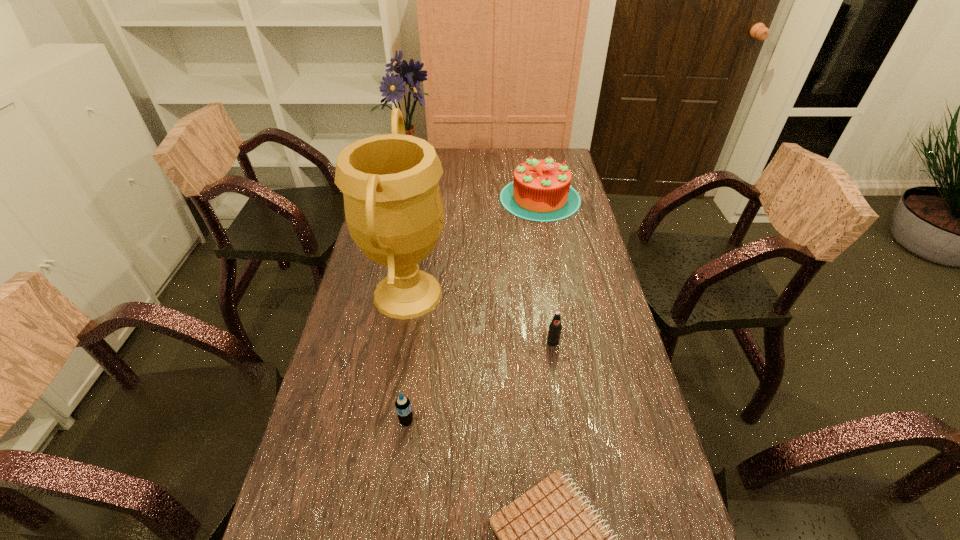
The width and height of the screenshot is (960, 540). What are the coordinates of `flower arrangement` in the screenshot? It's located at (393, 88).

At what (x,y) coordinates should I click in order to perform the action: click on trophy. Please return your answer as a coordinate pair (x, y). The image size is (960, 540). Looking at the image, I should click on (394, 211).

Where is `the fourth shortest object`? This screenshot has width=960, height=540. the fourth shortest object is located at coordinates pyautogui.click(x=541, y=191).

Identify the location of the farther soda bottle. The height and width of the screenshot is (540, 960). (555, 327).

Where is `the nearer soda bottle`? This screenshot has width=960, height=540. the nearer soda bottle is located at coordinates (403, 407).

This screenshot has width=960, height=540. Find the location of `the left soda bottle`. the left soda bottle is located at coordinates (403, 407).

Find the location of a particular element. blank area located on the front of the flower arrangement is located at coordinates (405, 227).

Identify the location of blank space located 0.360m on the engravings side of the trophy. The height and width of the screenshot is (540, 960). (568, 294).

Find the location of `free space located on the left of the cake`. free space located on the left of the cake is located at coordinates [x=454, y=198].

Where is `vacant space situated on the front label of the right soda bottle`? The image size is (960, 540). vacant space situated on the front label of the right soda bottle is located at coordinates (564, 414).